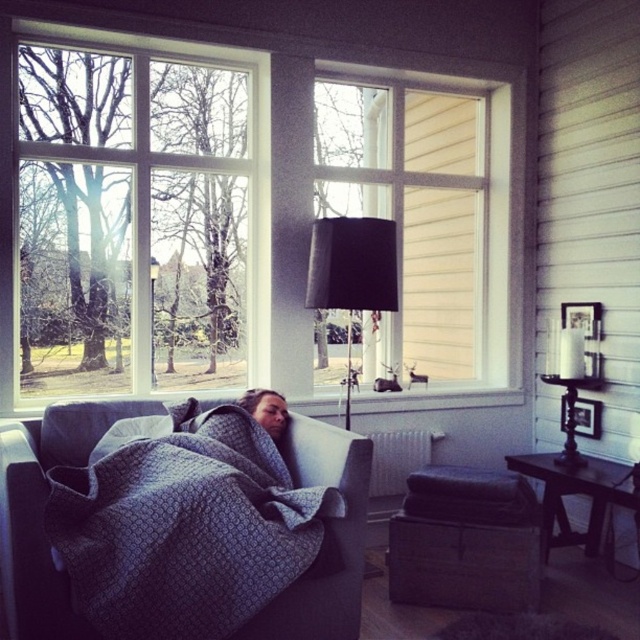
Is dark gray quilted blanket at center thinner than matte white window at center?

Yes.

Is point (195, 620) farther from camera compared to point (442, 256)?

No.

Measure the distance between point (186, 544) and camera.

2.28 meters

You are a GUI agent. You are given a task and a screenshot of the screen. Output one action in this format:
    pyautogui.click(x=<x>, y=<y>)
    Task: Click on the dark gray quilted blanket at center
    The width and height of the screenshot is (640, 640).
    Given the screenshot: What is the action you would take?
    pyautogui.click(x=192, y=531)

Locate an element on the screen. The width and height of the screenshot is (640, 640). dark gray quilted blanket at center is located at coordinates (192, 531).

Between dark gray quilted blanket at center and black fabric lampshade at center, which one has more height?

With more height is dark gray quilted blanket at center.

Locate an element on the screen. Image resolution: width=640 pixels, height=640 pixels. dark gray quilted blanket at center is located at coordinates (192, 531).

Between clear glass window at upper left and black fabric lampshade at center, which one has more height?

With more height is clear glass window at upper left.

Find the location of a particular element. clear glass window at upper left is located at coordinates (134, 214).